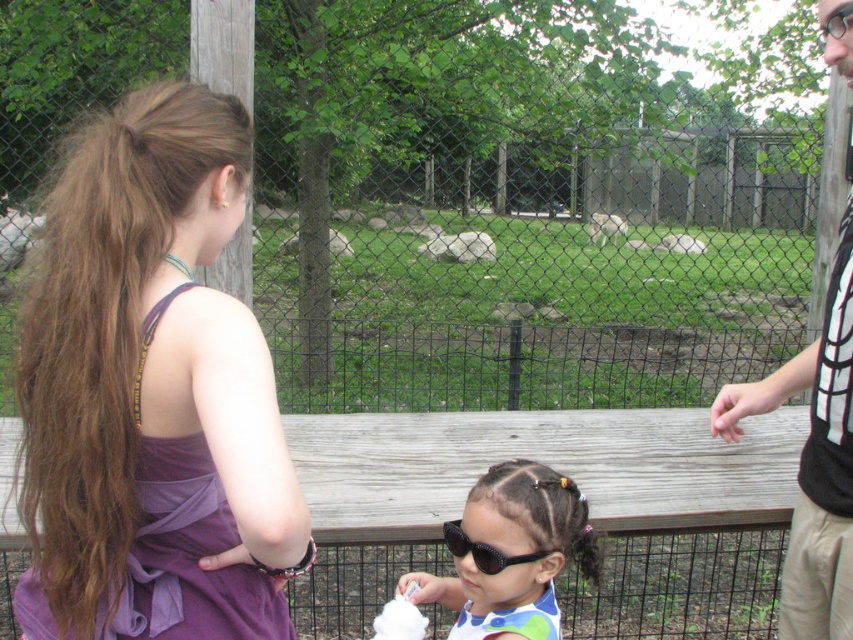
Which of these two, black and white shirt at upper right or white fur animal at center, stands taller?

Standing taller between the two is black and white shirt at upper right.

The height and width of the screenshot is (640, 853). What do you see at coordinates (813, 461) in the screenshot?
I see `black and white shirt at upper right` at bounding box center [813, 461].

This screenshot has height=640, width=853. In order to click on black and white shirt at upper right in this screenshot , I will do `click(813, 461)`.

Between metal mesh fence at center and black and white shirt at upper right, which one has more height?

metal mesh fence at center

Does metal mesh fence at center have a larger size compared to black and white shirt at upper right?

Result: Yes.

Is point (180, 10) closer to camera compared to point (804, 611)?

No, it is not.

Find the location of a particular element. metal mesh fence at center is located at coordinates (521, 204).

How much distance is there between purple fabric dress at left and white fur animal at center?

purple fabric dress at left and white fur animal at center are 54.97 feet apart.

Does purple fabric dress at left have a greater width compared to white fur animal at center?

No.

Does point (173, 369) come closer to viewer compared to point (700, 243)?

Yes, it is.

Image resolution: width=853 pixels, height=640 pixels. Identify the location of purple fabric dress at left. (151, 392).